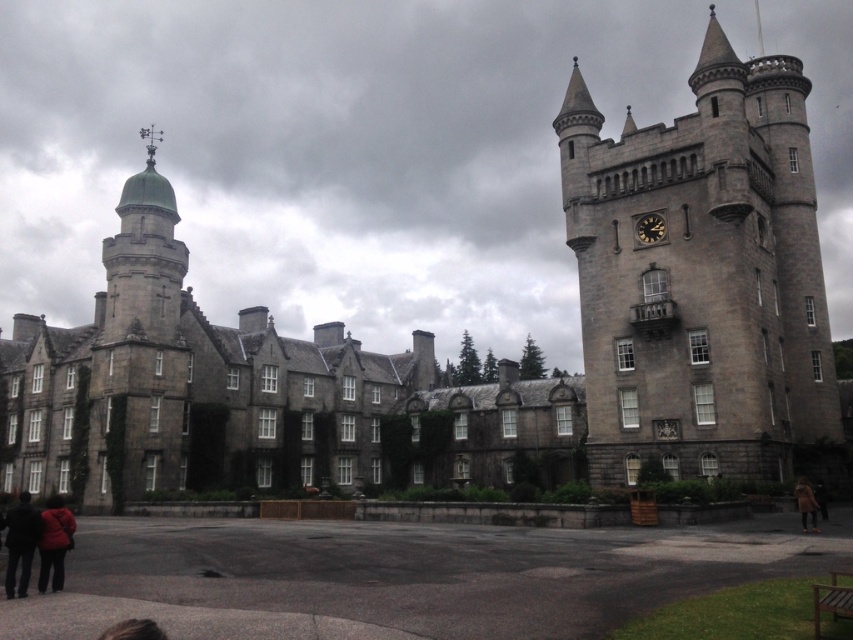
You are standing in front of the castle building and notice a point marked at coordinates (650,228). Based on the scene description, what object is located at this point?

The point at coordinates (650,228) corresponds to the black metal clock at center.

You are standing at the entrance of the castle and see the brown fuzzy coat at lower right. If you want to walk directly towards it, which direction should you move relative to the castle?

Since the brown fuzzy coat at lower right is located at point (x=805, y=502), you should move towards the lower right direction relative to the castle to reach it.

Consider the image. You are standing in the courtyard in front of the castle. You see a point at coordinates (805, 502). What object is located at that point?

The point at coordinates (805, 502) is located on the brown fuzzy coat at lower right.